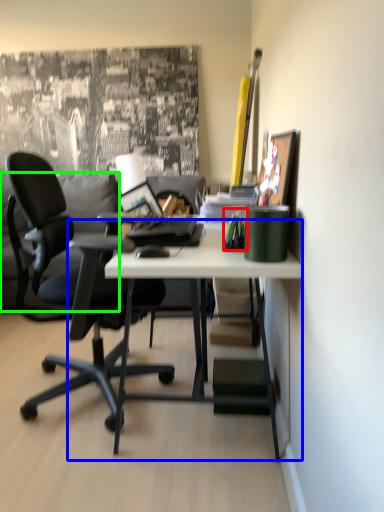
Question: Which object is the farthest from stationery (highlighted by a red box)? Choose among these: desk (highlighted by a blue box) or pillow (highlighted by a green box).

Choices:
 (A) desk
 (B) pillow

Answer: (B)